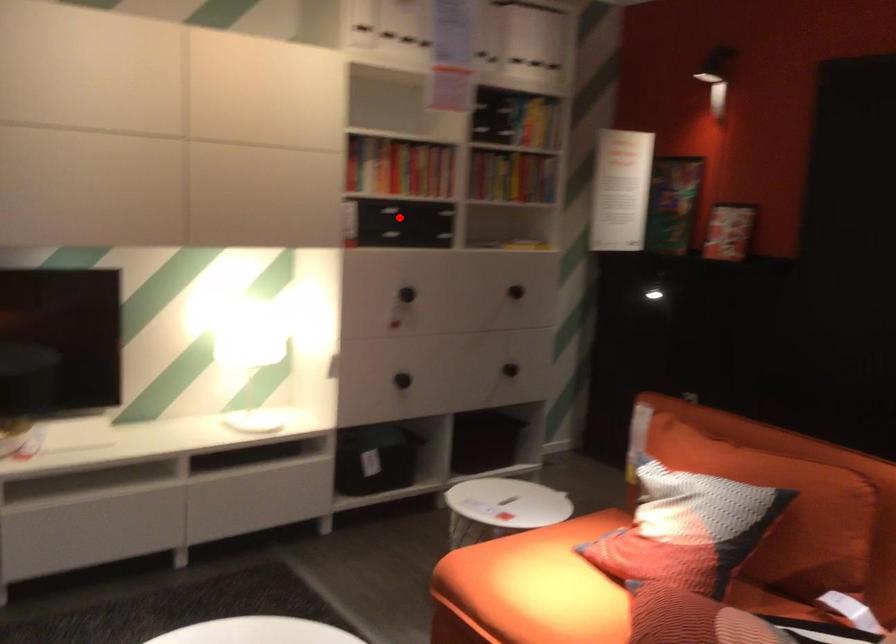
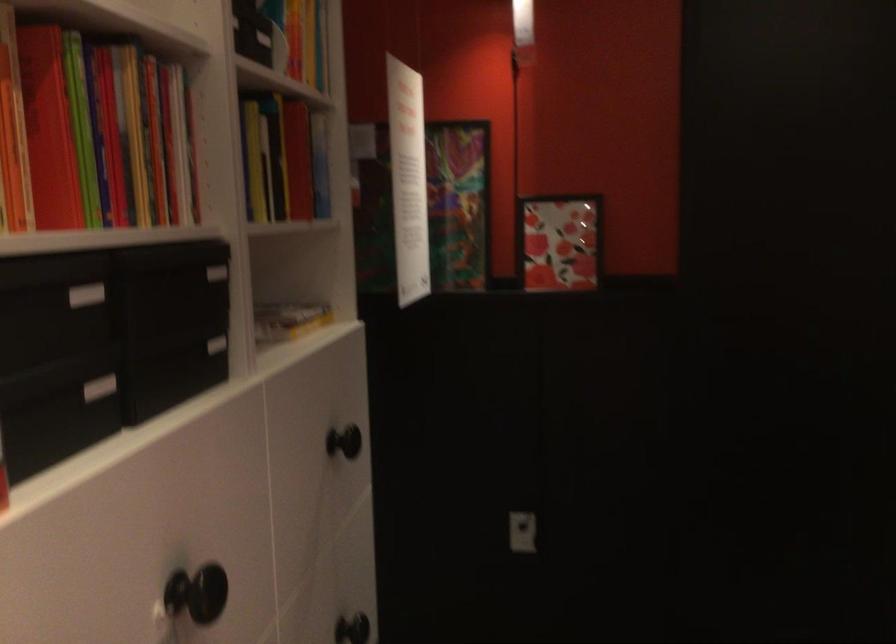
Where in the second image is the point corresponding to the highlighted location from the first image?

(99, 388)